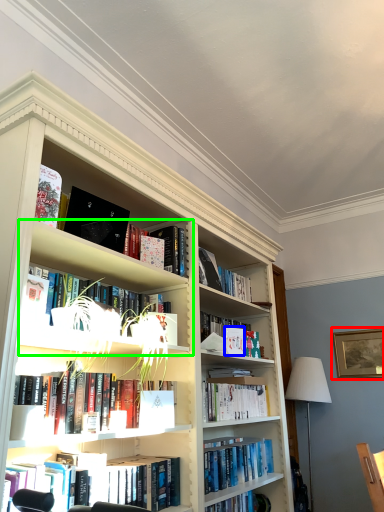
Question: Which is farther away from picture frame (highlighted by a red box)? paperback book (highlighted by a blue box) or cabinet (highlighted by a green box)?

Choices:
 (A) paperback book
 (B) cabinet

Answer: (B)